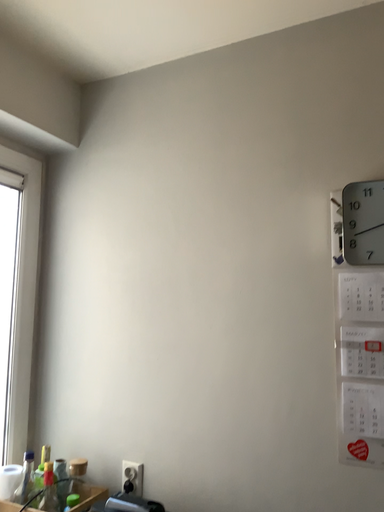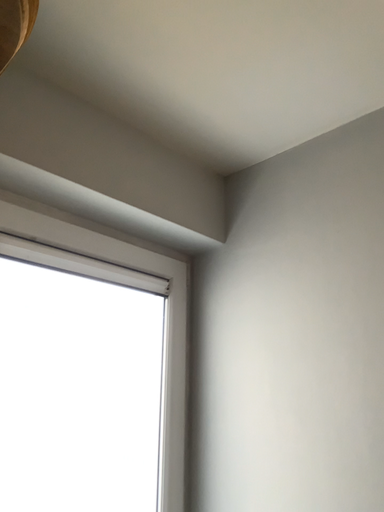
Question: How did the camera likely rotate when shooting the video?

Choices:
 (A) rotated right
 (B) rotated left

Answer: (B)